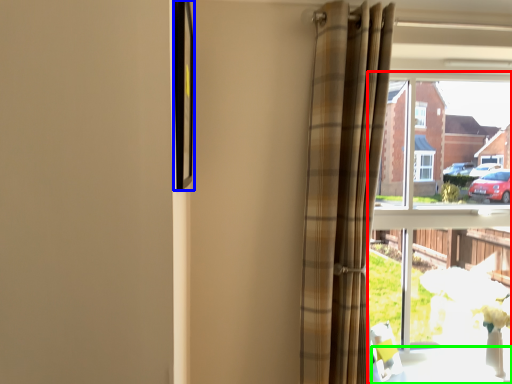
Question: Estimate the real-world distances between objects in this image. Which object is farther from window (highlighted by a red box), picture frame (highlighted by a blue box) or table (highlighted by a green box)?

Choices:
 (A) picture frame
 (B) table

Answer: (A)